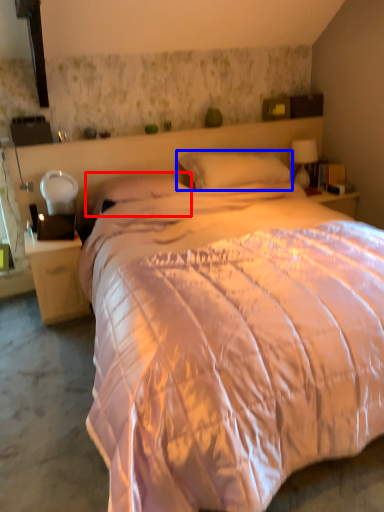
Question: Which object is further to the camera taking this photo, pillow (highlighted by a red box) or pillow (highlighted by a blue box)?

Choices:
 (A) pillow
 (B) pillow

Answer: (B)